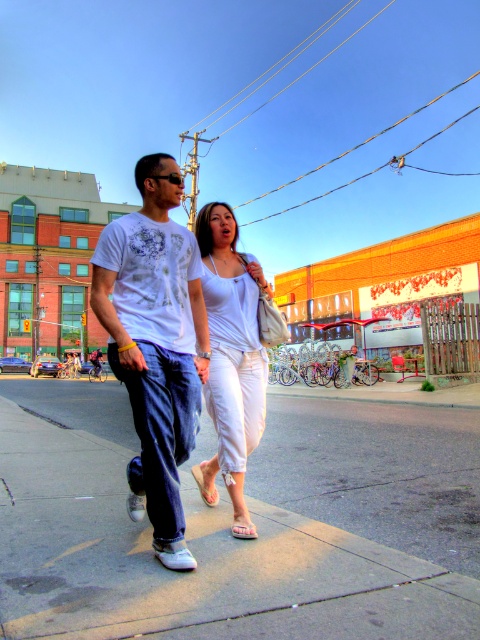
Question: Which object appears farthest from the camera in this image?

Choices:
 (A) white cotton pants at center
 (B) white matte t-shirt at center

Answer: (A)

Question: Considering the relative positions of white matte t-shirt at center and white cotton pants at center in the image provided, where is white matte t-shirt at center located with respect to white cotton pants at center?

Choices:
 (A) above
 (B) below

Answer: (A)

Question: Is the position of white matte t-shirt at center less distant than that of white cotton pants at center?

Choices:
 (A) yes
 (B) no

Answer: (A)

Question: Which object is positioned farthest from the white cotton pants at center?

Choices:
 (A) gray concrete sidewalk at center
 (B) white matte t-shirt at center

Answer: (A)

Question: Does gray concrete sidewalk at center have a smaller size compared to white matte t-shirt at center?

Choices:
 (A) yes
 (B) no

Answer: (A)

Question: Among these objects, which one is nearest to the camera?

Choices:
 (A) white matte t-shirt at center
 (B) gray concrete sidewalk at center
 (C) white cotton pants at center

Answer: (B)